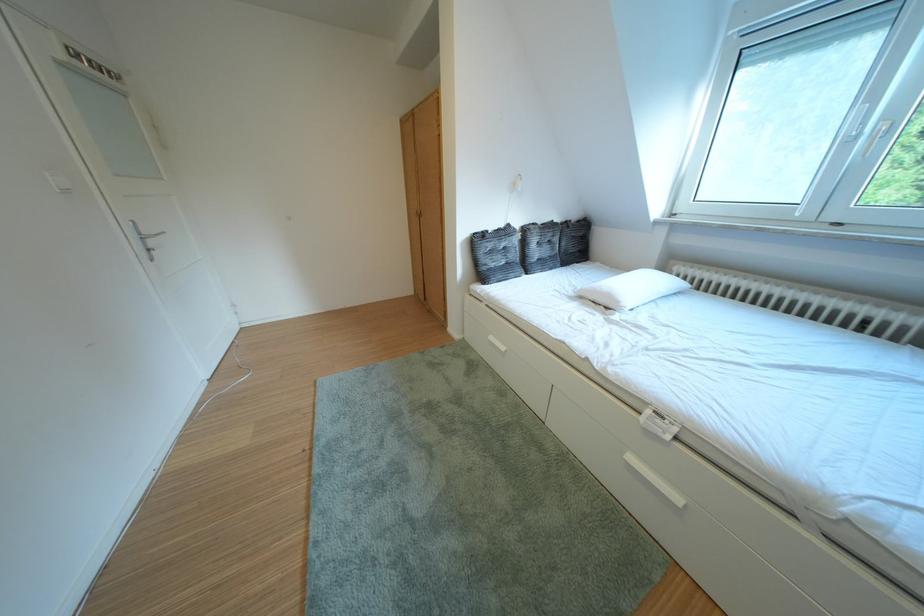
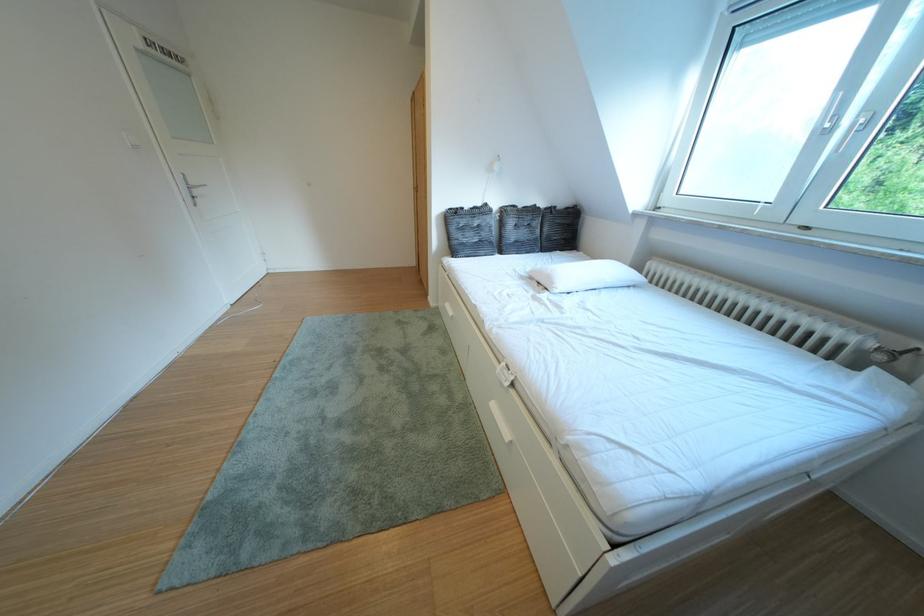
In the second image, find the point that corresponds to [497,273] in the first image.

(468, 246)